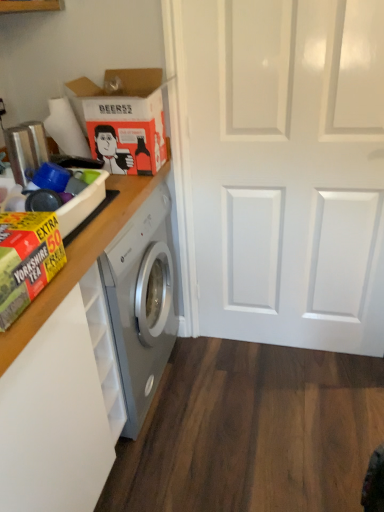
Question: Can you confirm if orange matte cardboard box at upper left, the 2th cardboard box in the front-to-back sequence, is smaller than white glossy door at center?

Choices:
 (A) no
 (B) yes

Answer: (B)

Question: Are orange matte cardboard box at upper left, marked as the first cardboard box in a top-to-bottom arrangement, and white glossy door at center located far from each other?

Choices:
 (A) no
 (B) yes

Answer: (A)

Question: Is orange matte cardboard box at upper left, the 2th cardboard box in the front-to-back sequence, in front of white glossy door at center?

Choices:
 (A) yes
 (B) no

Answer: (B)

Question: Considering the relative sizes of orange matte cardboard box at upper left, the 2th cardboard box in the front-to-back sequence, and white glossy door at center in the image provided, is orange matte cardboard box at upper left, the 2th cardboard box in the front-to-back sequence, thinner than white glossy door at center?

Choices:
 (A) no
 (B) yes

Answer: (A)

Question: Does orange matte cardboard box at upper left, the first cardboard box when ordered from back to front, have a greater height compared to white glossy door at center?

Choices:
 (A) yes
 (B) no

Answer: (B)

Question: Would you say orange matte cardboard box at upper left, arranged as the 2th cardboard box when ordered from the bottom, is inside or outside yellow-green cardboard box at left, which is the first cardboard box from front to back?

Choices:
 (A) inside
 (B) outside

Answer: (B)

Question: From a real-world perspective, is orange matte cardboard box at upper left, the first cardboard box when ordered from back to front, physically located above or below yellow-green cardboard box at left, marked as the second cardboard box in a top-to-bottom arrangement?

Choices:
 (A) above
 (B) below

Answer: (A)

Question: Considering the positions of orange matte cardboard box at upper left, arranged as the 2th cardboard box when ordered from the bottom, and yellow-green cardboard box at left, marked as the second cardboard box in a top-to-bottom arrangement, in the image, is orange matte cardboard box at upper left, arranged as the 2th cardboard box when ordered from the bottom, wider or thinner than yellow-green cardboard box at left, marked as the second cardboard box in a top-to-bottom arrangement,?

Choices:
 (A) wide
 (B) thin

Answer: (A)

Question: From their relative heights in the image, would you say orange matte cardboard box at upper left, arranged as the 2th cardboard box when ordered from the bottom, is taller or shorter than yellow-green cardboard box at left, the second cardboard box when ordered from back to front?

Choices:
 (A) short
 (B) tall

Answer: (B)

Question: Considering the positions of white glossy door at center and yellow cardboard box at left in the image, is white glossy door at center bigger or smaller than yellow cardboard box at left?

Choices:
 (A) big
 (B) small

Answer: (A)

Question: Considering the relative positions of white glossy door at center and yellow cardboard box at left in the image provided, is white glossy door at center to the left or to the right of yellow cardboard box at left?

Choices:
 (A) left
 (B) right

Answer: (B)

Question: From the image's perspective, relative to yellow cardboard box at left, is white glossy door at center above or below?

Choices:
 (A) above
 (B) below

Answer: (A)

Question: Looking at their shapes, would you say white glossy door at center is wider or thinner than yellow cardboard box at left?

Choices:
 (A) wide
 (B) thin

Answer: (B)

Question: Considering the positions of yellow-green cardboard box at left, the second cardboard box when ordered from back to front, and yellow cardboard box at left in the image, is yellow-green cardboard box at left, the second cardboard box when ordered from back to front, bigger or smaller than yellow cardboard box at left?

Choices:
 (A) big
 (B) small

Answer: (B)

Question: Is yellow-green cardboard box at left, the 1th cardboard box when ordered from bottom to top, inside the boundaries of yellow cardboard box at left, or outside?

Choices:
 (A) inside
 (B) outside

Answer: (B)